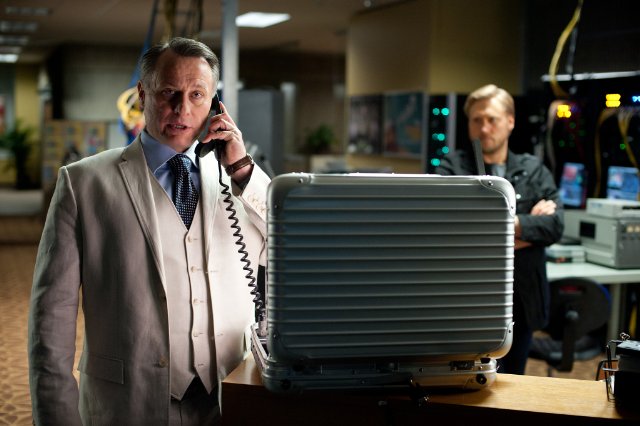
What are the coordinates of `phone cord` in the screenshot? It's located at (246, 243).